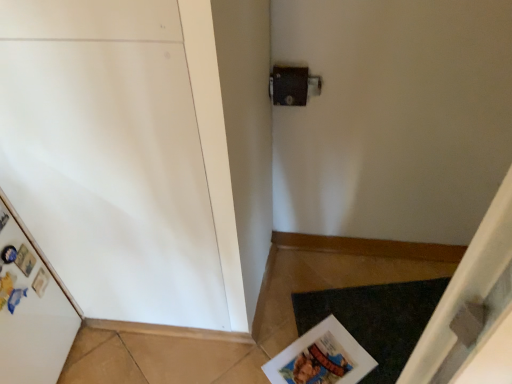
At what (x,y) coordinates should I click in order to perform the action: click on free space above matte paper magazine at lower right (from a real-world perspective). Please return your answer as a coordinate pair (x, y). Looking at the image, I should click on (323, 355).